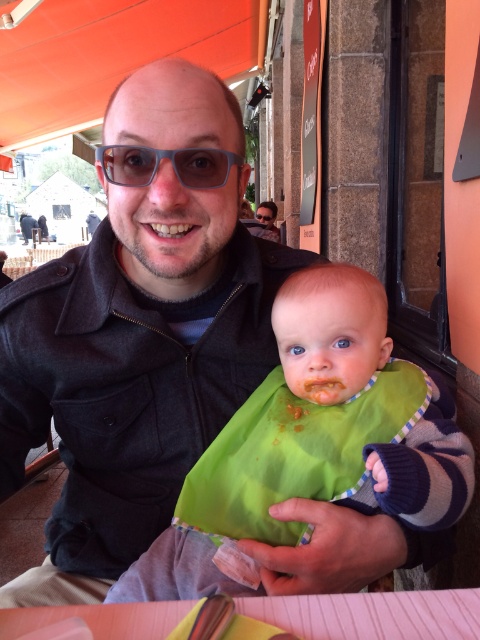
Question: Which of the following is the closest to the observer?

Choices:
 (A) (279, 376)
 (B) (214, 163)
 (C) (132, 627)

Answer: (C)

Question: Among these points, which one is nearest to the camera?

Choices:
 (A) (24, 224)
 (B) (127, 150)

Answer: (B)

Question: Does transparent plastic goggles at center come in front of matte black jacket at center?

Choices:
 (A) no
 (B) yes

Answer: (B)

Question: Which object appears closest to the camera in this image?

Choices:
 (A) green fabric bib at center
 (B) matte black jacket at center
 (C) transparent plastic goggles at center

Answer: (A)

Question: Where is green fabric bib at center located in relation to transparent plastic goggles at center in the image?

Choices:
 (A) right
 (B) left

Answer: (A)

Question: Can you confirm if pink paper at lower center is positioned to the right of transparent plastic goggles at center?

Choices:
 (A) no
 (B) yes

Answer: (B)